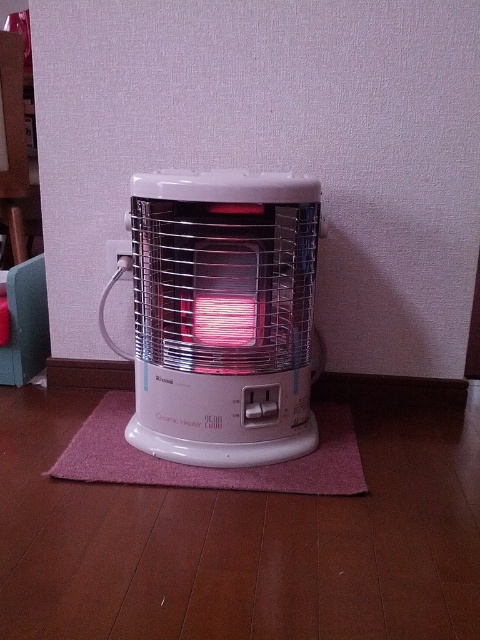
Question: Does white glossy ceramic heater at center appear under pink fabric mat at center?

Choices:
 (A) yes
 (B) no

Answer: (B)

Question: Can you confirm if white glossy ceramic heater at center is positioned to the right of pink fabric mat at center?

Choices:
 (A) no
 (B) yes

Answer: (A)

Question: Can you confirm if white glossy ceramic heater at center is thinner than pink fabric mat at center?

Choices:
 (A) no
 (B) yes

Answer: (B)